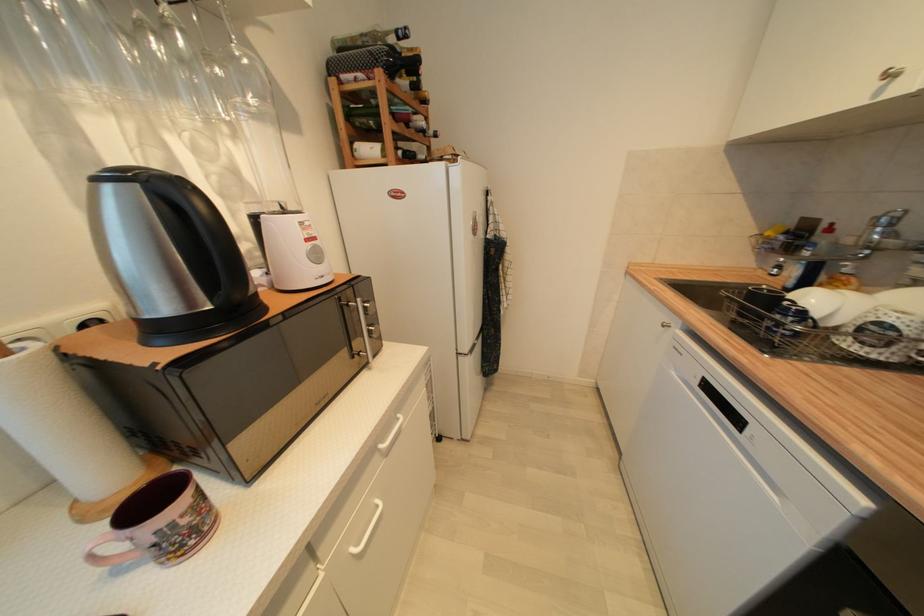
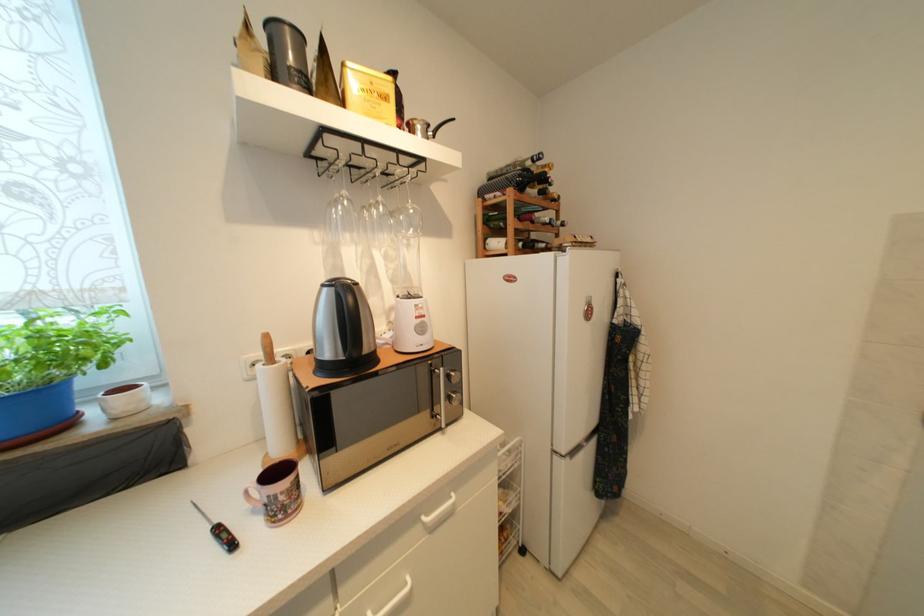
Locate, in the second image, the point that corresponds to point (373, 334) in the first image.

(455, 400)